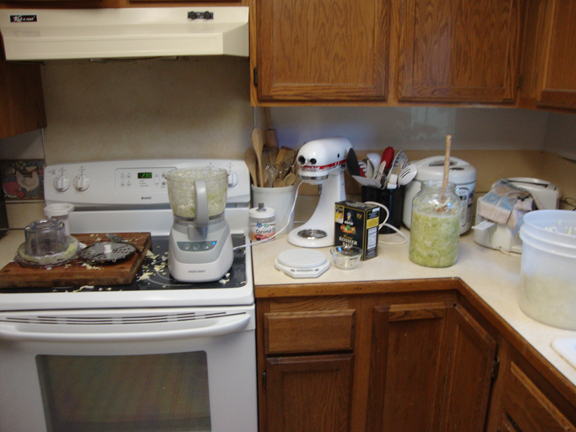
Locate an element on the screen. Image resolution: width=576 pixels, height=432 pixels. toaster is located at coordinates (548, 194).